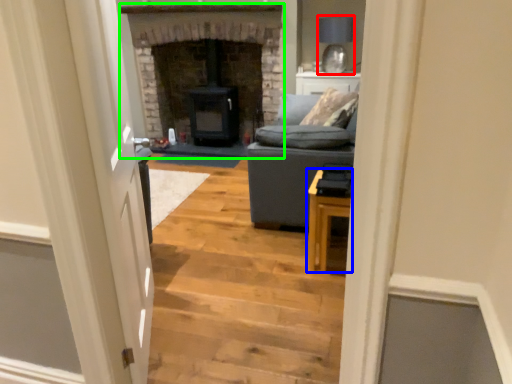
Question: Which object is the closest to the lamp (highlighted by a red box)? Choose among these: table (highlighted by a blue box) or fireplace (highlighted by a green box).

Choices:
 (A) table
 (B) fireplace

Answer: (B)